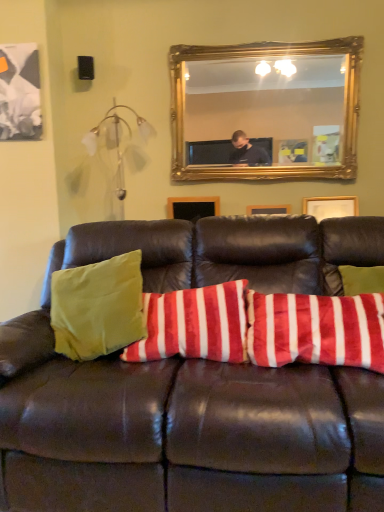
Image resolution: width=384 pixels, height=512 pixels. I want to click on leather couch at center, so click(x=194, y=387).

What is the approximate width of gold-framed mirror at upper center?

gold-framed mirror at upper center is 8.18 centimeters in width.

Where is `leather couch at center`? leather couch at center is located at coordinates (194, 387).

Considering the sizes of leather couch at center and velvety red and white striped pillow at center in the image, is leather couch at center taller or shorter than velvety red and white striped pillow at center?

Considering their sizes, leather couch at center has more height than velvety red and white striped pillow at center.

From a real-world perspective, is leather couch at center on top of velvety red and white striped pillow at center?

No, from a real-world perspective, leather couch at center is not on top of velvety red and white striped pillow at center.

Is leather couch at center facing away from velvety red and white striped pillow at center?

Correct, leather couch at center is looking away from velvety red and white striped pillow at center.

Is velvety red and white striped pillow at center surrounded by leather couch at center?

Yes, velvety red and white striped pillow at center can be found within leather couch at center.

Is leather couch at center turned away from gold-framed mirror at upper center?

leather couch at center is not turned away from gold-framed mirror at upper center.

From the image's perspective, does leather couch at center appear lower than gold-framed mirror at upper center?

Indeed, from the image's perspective, leather couch at center is shown beneath gold-framed mirror at upper center.

Visually, is leather couch at center positioned to the left or to the right of gold-framed mirror at upper center?

Based on their positions, leather couch at center is located to the left of gold-framed mirror at upper center.

Is velvety red and white striped pillow at center situated inside gold-framed mirror at upper center or outside?

velvety red and white striped pillow at center lies outside gold-framed mirror at upper center.

Considering the sizes of velvety red and white striped pillow at center and gold-framed mirror at upper center in the image, is velvety red and white striped pillow at center bigger or smaller than gold-framed mirror at upper center?

Considering their sizes, velvety red and white striped pillow at center takes up less space than gold-framed mirror at upper center.

Which is more distant, (x=241, y=329) or (x=257, y=118)?

The point (x=257, y=118) is farther from the camera.

Considering the positions of objects velvety red and white striped pillow at center and gold-framed mirror at upper center in the image provided, who is behind, velvety red and white striped pillow at center or gold-framed mirror at upper center?

gold-framed mirror at upper center is further away from the camera.

Is gold-framed mirror at upper center not near velvety red and white striped pillow at center?

That's right, there is a large distance between gold-framed mirror at upper center and velvety red and white striped pillow at center.

Is velvety red and white striped pillow at center surrounded by gold-framed mirror at upper center?

That's incorrect, velvety red and white striped pillow at center is not inside gold-framed mirror at upper center.

Is gold-framed mirror at upper center further to camera compared to velvety red and white striped pillow at center?

Yes, the depth of gold-framed mirror at upper center is greater than that of velvety red and white striped pillow at center.

From the image's perspective, is gold-framed mirror at upper center located beneath velvety red and white striped pillow at center?

No, from the image's perspective, gold-framed mirror at upper center is not beneath velvety red and white striped pillow at center.

Considering the relative sizes of velvety red and white striped pillow at center and leather couch at center in the image provided, is velvety red and white striped pillow at center thinner than leather couch at center?

Correct, the width of velvety red and white striped pillow at center is less than that of leather couch at center.

Is velvety red and white striped pillow at center in front of or behind leather couch at center in the image?

Clearly, velvety red and white striped pillow at center is behind leather couch at center.

Between velvety red and white striped pillow at center and leather couch at center, which one has larger size?

With larger size is leather couch at center.

Is velvety red and white striped pillow at center touching leather couch at center?

They are not placed beside each other.

Considering the positions of objects gold-framed mirror at upper center and leather couch at center in the image provided, who is more to the left, gold-framed mirror at upper center or leather couch at center?

Positioned to the left is leather couch at center.

Who is bigger, gold-framed mirror at upper center or leather couch at center?

leather couch at center is bigger.

Where is `studio couch on the left of the gold-framed mirror at upper center`? studio couch on the left of the gold-framed mirror at upper center is located at coordinates (194, 387).

Could you tell me if gold-framed mirror at upper center is turned towards leather couch at center?

No, gold-framed mirror at upper center is not aimed at leather couch at center.

There is a leather couch at center. At what (x,y) coordinates should I click in order to perform the action: click on pillow above it (from a real-world perspective). Please return your answer as a coordinate pair (x, y). Looking at the image, I should click on (194, 325).

Identify the location of studio couch that is below the gold-framed mirror at upper center (from the image's perspective). The width and height of the screenshot is (384, 512). (194, 387).

Considering their positions, is velvety red and white striped pillow at center positioned further to leather couch at center than gold-framed mirror at upper center?

gold-framed mirror at upper center is positioned further to the anchor leather couch at center.

Which object lies nearer to the anchor point gold-framed mirror at upper center, velvety red and white striped pillow at center or leather couch at center?

Among the two, velvety red and white striped pillow at center is located nearer to gold-framed mirror at upper center.

From the image, which object appears to be farther from velvety red and white striped pillow at center, leather couch at center or gold-framed mirror at upper center?

The object further to velvety red and white striped pillow at center is gold-framed mirror at upper center.

Which object lies further to the anchor point gold-framed mirror at upper center, leather couch at center or velvety red and white striped pillow at center?

leather couch at center.

From the picture: When comparing their distances from velvety red and white striped pillow at center, does gold-framed mirror at upper center or leather couch at center seem closer?

leather couch at center is positioned closer to the anchor velvety red and white striped pillow at center.

Considering their positions, is gold-framed mirror at upper center positioned closer to leather couch at center than velvety red and white striped pillow at center?

The object closer to leather couch at center is velvety red and white striped pillow at center.

Find the location of `pillow between gold-framed mirror at upper center and leather couch at center vertically`. pillow between gold-framed mirror at upper center and leather couch at center vertically is located at coordinates pos(194,325).